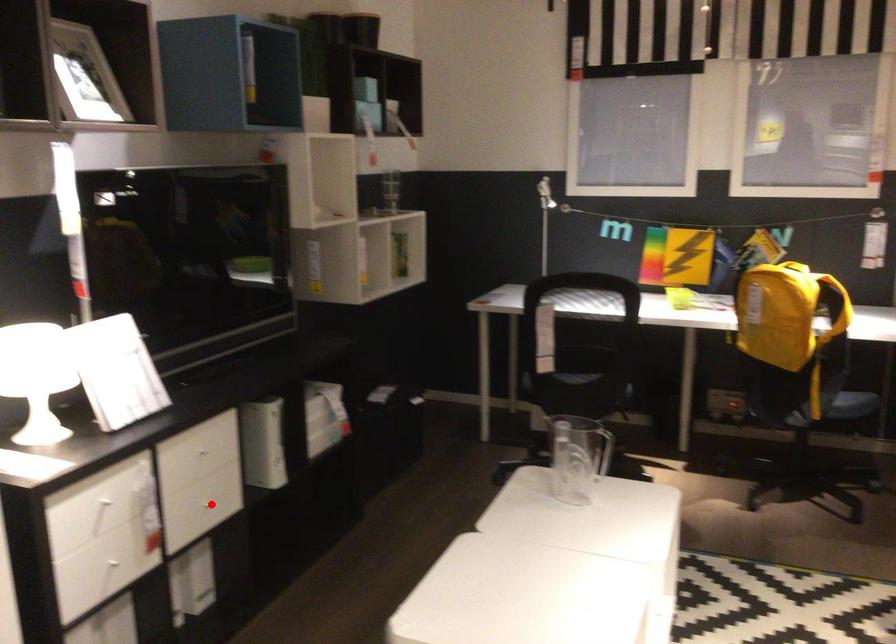
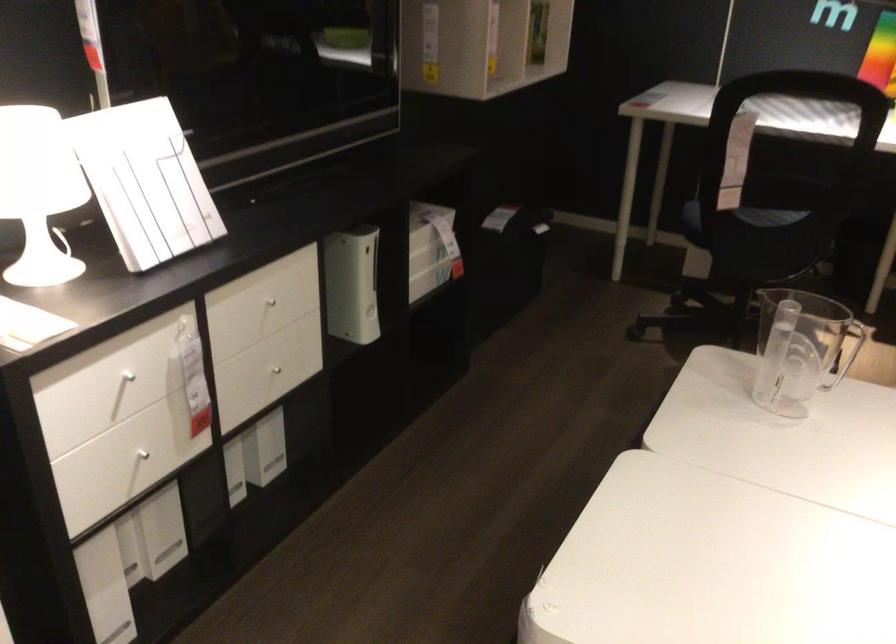
Locate, in the second image, the point that corresponds to the highlighted location in the first image.

(279, 366)